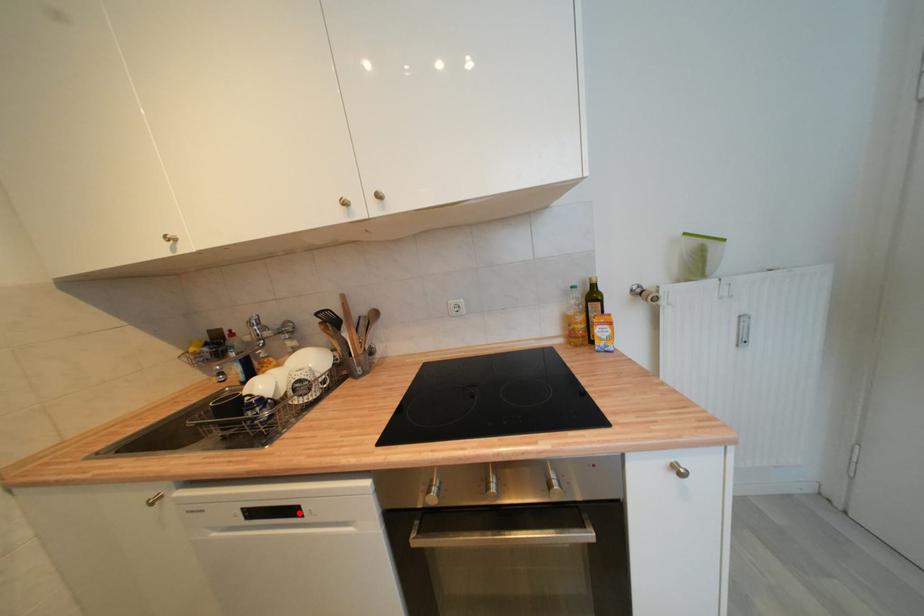
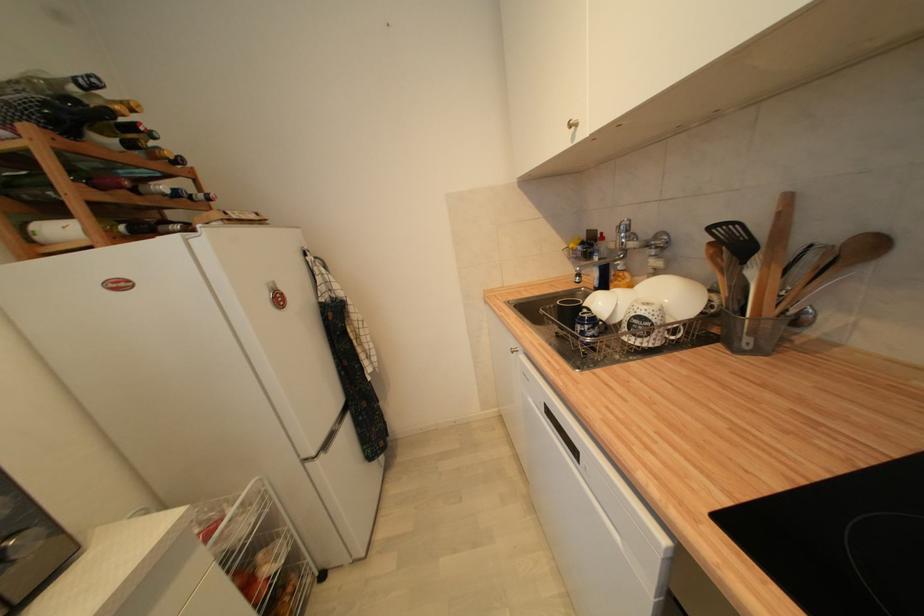
Where in the second image is the point corresponding to the highlighted location from the first image?

(578, 453)